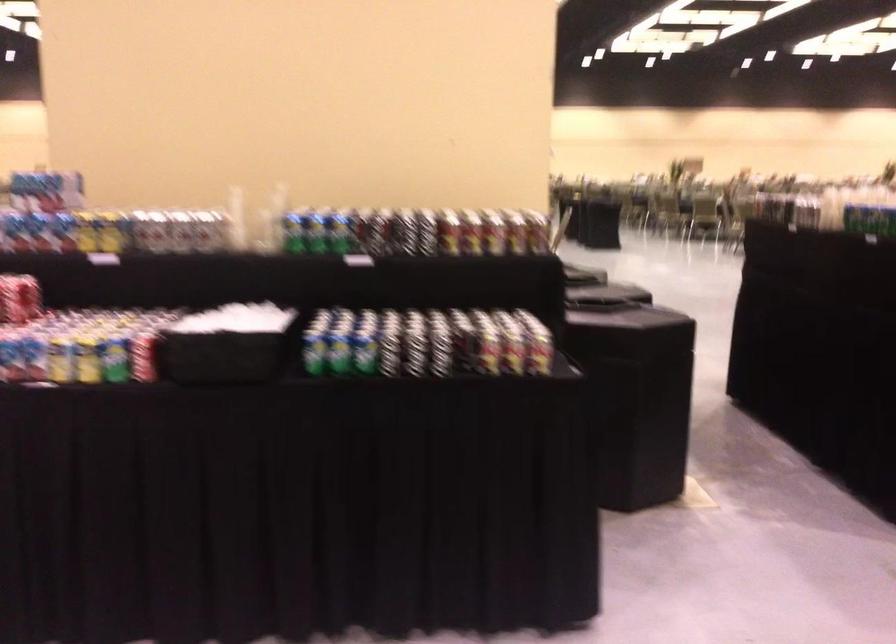
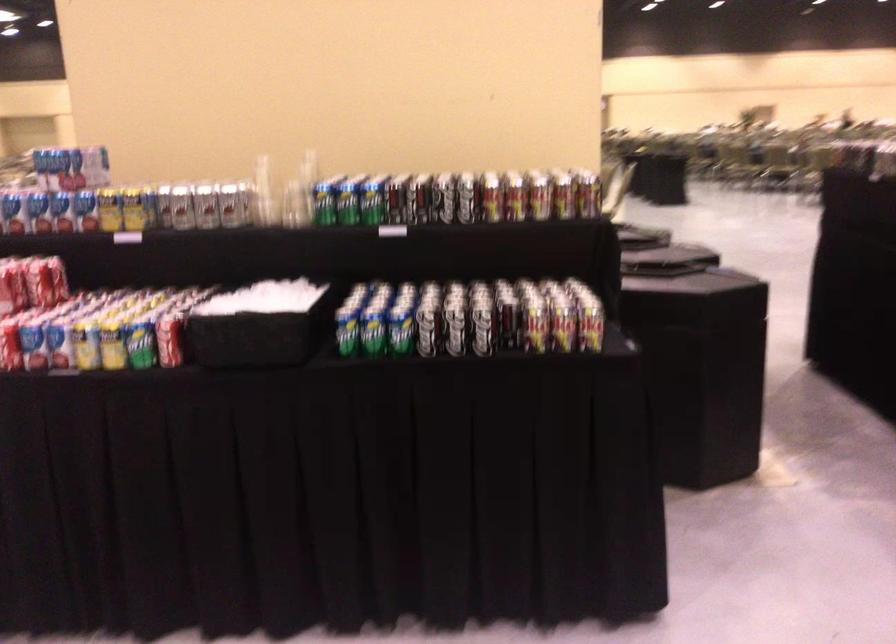
Where in the second image is the point corresponding to pixel 156 232 from the first image?

(182, 207)